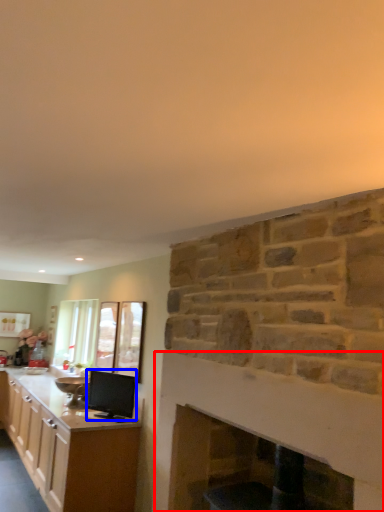
Question: Which object appears farthest to the camera in this image, fireplace (highlighted by a red box) or appliance (highlighted by a blue box)?

Choices:
 (A) fireplace
 (B) appliance

Answer: (B)